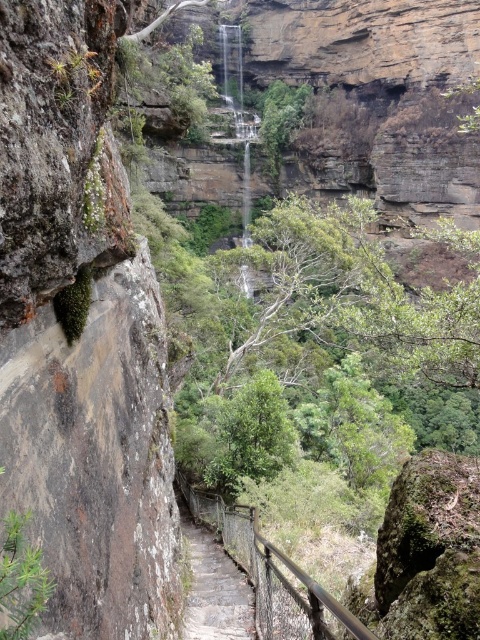
Question: Is metal/rustic rail at center further to the viewer compared to gray stone steps at center?

Choices:
 (A) no
 (B) yes

Answer: (A)

Question: Does metal/rustic rail at center have a greater width compared to gray stone steps at center?

Choices:
 (A) no
 (B) yes

Answer: (B)

Question: Among these points, which one is farthest from the camera?

Choices:
 (A) (210, 532)
 (B) (227, 531)

Answer: (A)

Question: Is metal/rustic rail at center positioned behind gray stone steps at center?

Choices:
 (A) yes
 (B) no

Answer: (B)